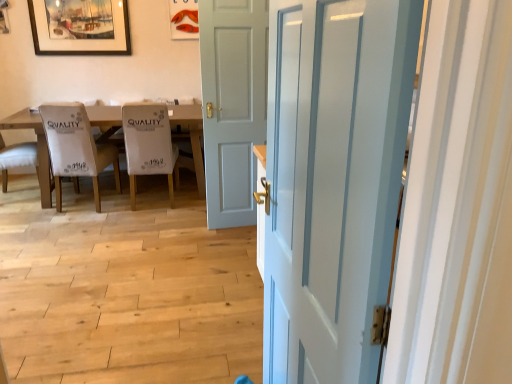
This screenshot has height=384, width=512. What are the coordinates of `free region under white fabric chair at left, the 3th chair from the right (from a real-world perspective)` in the screenshot? It's located at pyautogui.click(x=13, y=193).